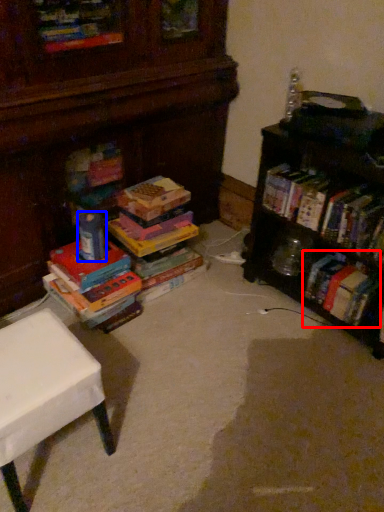
Question: Which point is further to the camera, book (highlighted by a red box) or toy (highlighted by a blue box)?

Choices:
 (A) book
 (B) toy

Answer: (A)